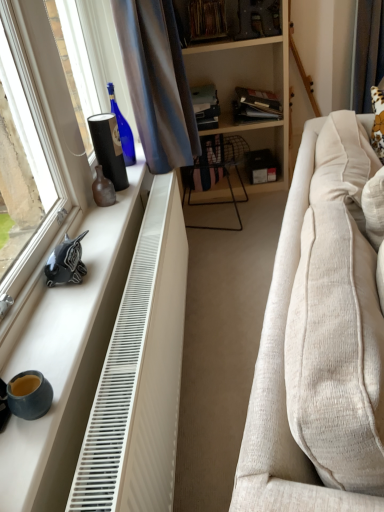
You are a GUI agent. You are given a task and a screenshot of the screen. Output one action in this format:
    pyautogui.click(x=<x>, y=<y>)
    Task: Click on the vacant region above hardcover book at center, which is counted as the 3th book, starting from the right (from a real-world perspective)
    Image resolution: width=384 pixels, height=512 pixels.
    Given the screenshot: What is the action you would take?
    pyautogui.click(x=198, y=89)